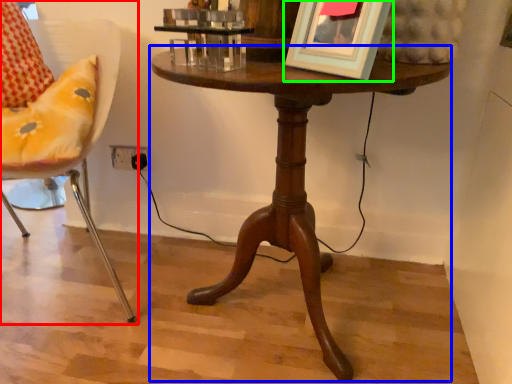
Question: Which is farther away from chair (highlighted by a red box)? table (highlighted by a blue box) or picture frame (highlighted by a green box)?

Choices:
 (A) table
 (B) picture frame

Answer: (B)